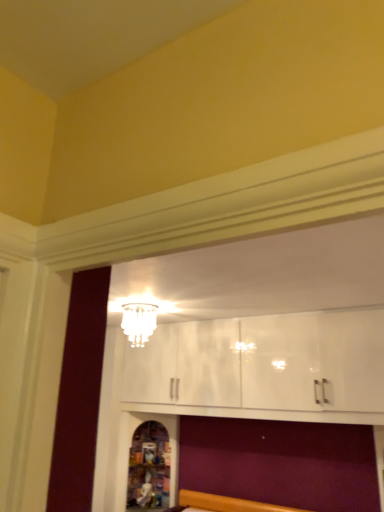
Question: In terms of width, does white glass chandelier at upper center look wider or thinner when compared to wooden carved statue at lower center?

Choices:
 (A) wide
 (B) thin

Answer: (B)

Question: Is white glass chandelier at upper center to the left or to the right of wooden carved statue at lower center in the image?

Choices:
 (A) right
 (B) left

Answer: (A)

Question: From the image's perspective, is white glass chandelier at upper center positioned above or below wooden carved statue at lower center?

Choices:
 (A) above
 (B) below

Answer: (A)

Question: From a real-world perspective, is wooden carved statue at lower center physically located above or below white glass chandelier at upper center?

Choices:
 (A) below
 (B) above

Answer: (A)

Question: Looking at the image, does wooden carved statue at lower center seem bigger or smaller compared to white glass chandelier at upper center?

Choices:
 (A) big
 (B) small

Answer: (A)

Question: Would you say wooden carved statue at lower center is to the left or to the right of white glass chandelier at upper center in the picture?

Choices:
 (A) right
 (B) left

Answer: (B)

Question: Is wooden carved statue at lower center spatially inside white glass chandelier at upper center, or outside of it?

Choices:
 (A) inside
 (B) outside

Answer: (B)